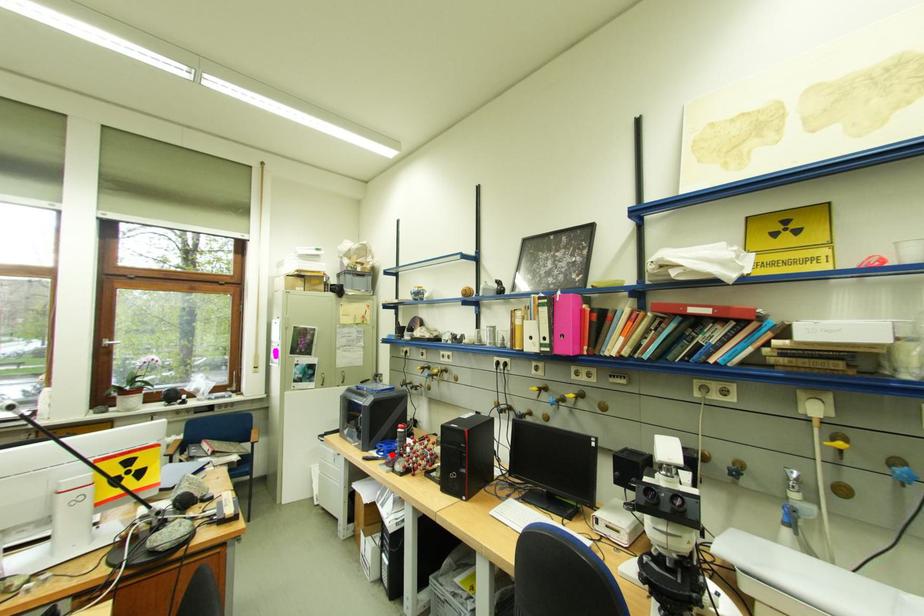
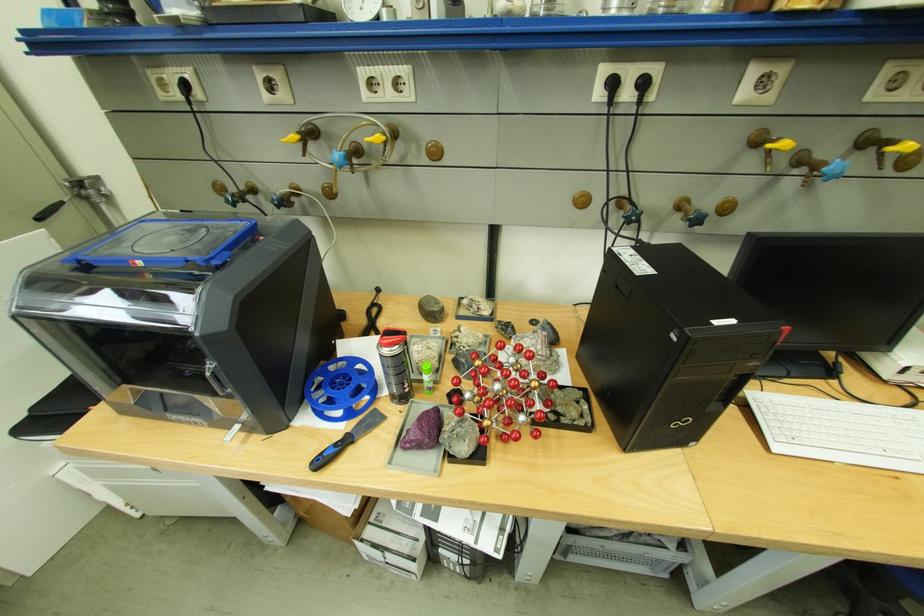
Where in the second image is the point corresponding to the highlighted location from the first image?

(349, 413)